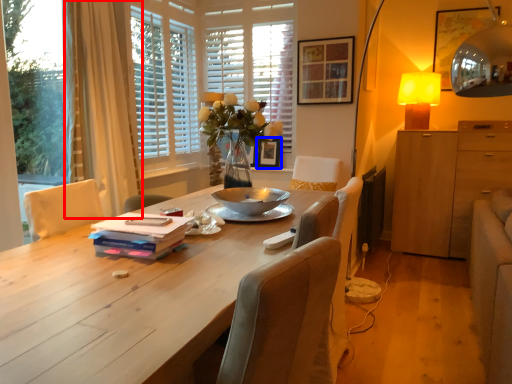
Question: Which object is further to the camera taking this photo, curtain (highlighted by a red box) or picture frame (highlighted by a blue box)?

Choices:
 (A) curtain
 (B) picture frame

Answer: (B)